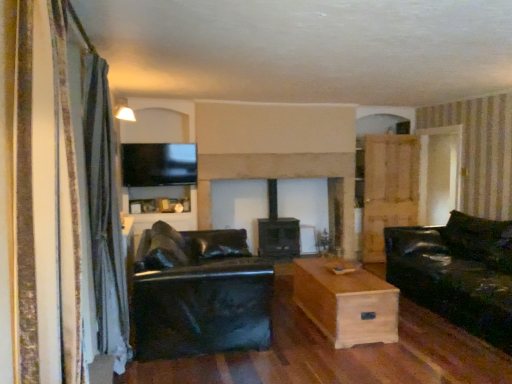
Question: From the image's perspective, is light brown wood armoire at right located above or below black leather couch at center, acting as the 1th studio couch starting from the left?

Choices:
 (A) above
 (B) below

Answer: (A)

Question: Is light brown wood armoire at right bigger or smaller than black leather couch at center, acting as the 2th studio couch starting from the right?

Choices:
 (A) big
 (B) small

Answer: (B)

Question: Which is nearer to the gray fabric curtain at left, the 2th curtain positioned from the front?

Choices:
 (A) black leather couch at right, marked as the 2th studio couch in a left-to-right arrangement
 (B) transparent glass door at upper right
 (C) striped fabric curtain at left, placed as the 1th curtain when sorted from front to back
 (D) light brown wood coffee table at center
 (E) black leather couch at center, acting as the 1th studio couch starting from the left

Answer: (E)

Question: Considering the real-world distances, which object is closest to the black leather couch at right, marked as the 1th studio couch in a right-to-left arrangement?

Choices:
 (A) transparent glass door at upper right
 (B) striped fabric curtain at left, acting as the second curtain starting from the left
 (C) light brown wood coffee table at center
 (D) light brown wood armoire at right
 (E) black leather couch at center, acting as the 2th studio couch starting from the right

Answer: (C)